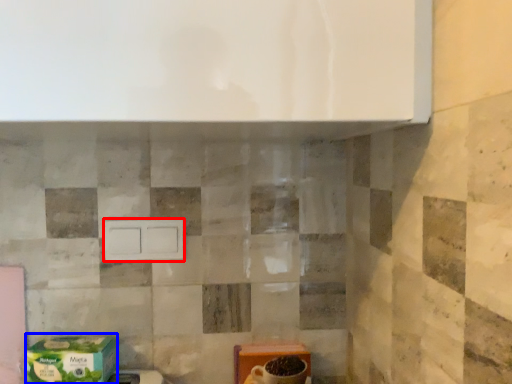
Question: Which object is closer to the camera taking this photo, drawer (highlighted by a red box) or cardboard box (highlighted by a blue box)?

Choices:
 (A) drawer
 (B) cardboard box

Answer: (B)